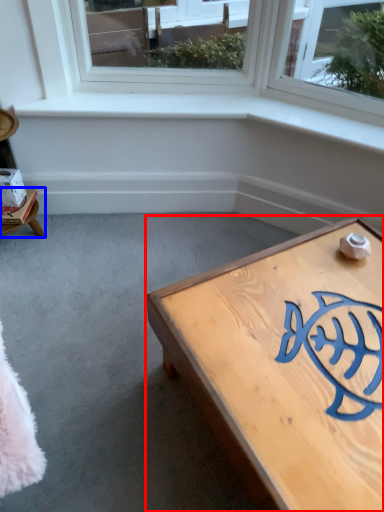
Question: Among these objects, which one is farthest to the camera, coffee table (highlighted by a red box) or furniture (highlighted by a blue box)?

Choices:
 (A) coffee table
 (B) furniture

Answer: (B)